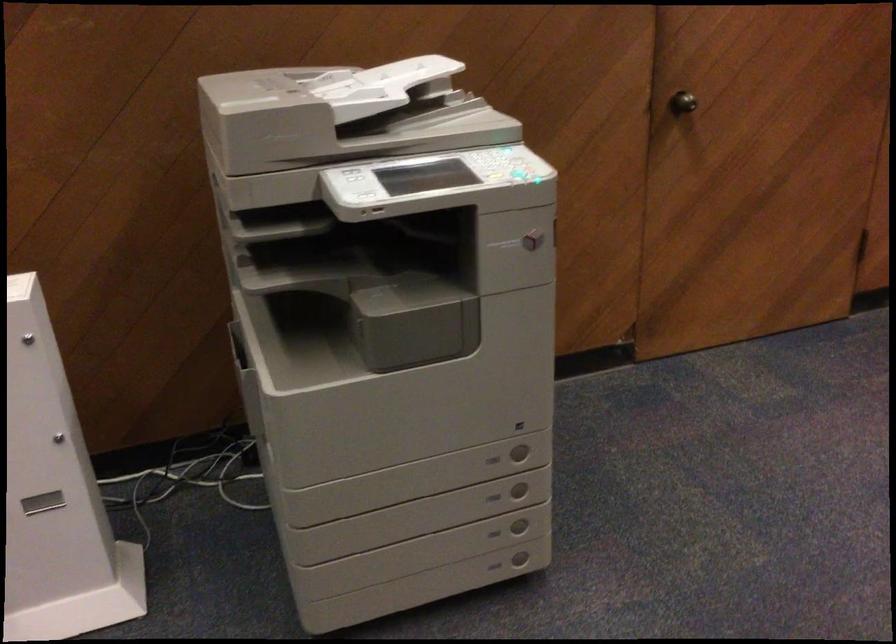
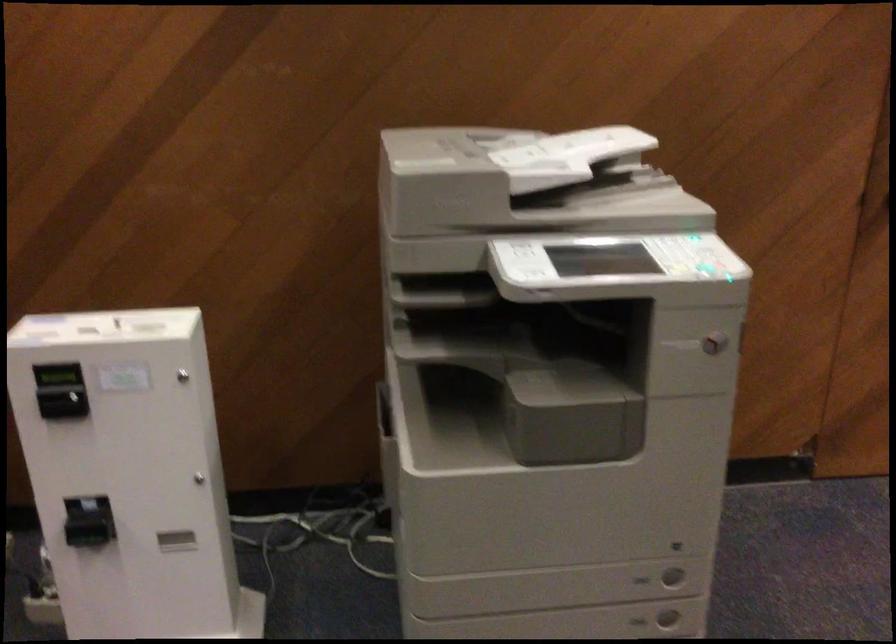
Question: In a continuous first-person perspective shot, in which direction is the camera moving?

Choices:
 (A) Left
 (B) Right
 (C) Forward
 (D) Backward

Answer: (C)